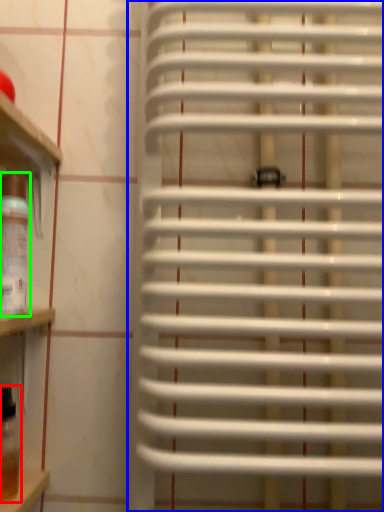
Question: Considering the real-world distances, which object is farthest from wine bottle (highlighted by a red box)? window blind (highlighted by a blue box) or wine bottle (highlighted by a green box)?

Choices:
 (A) window blind
 (B) wine bottle

Answer: (A)